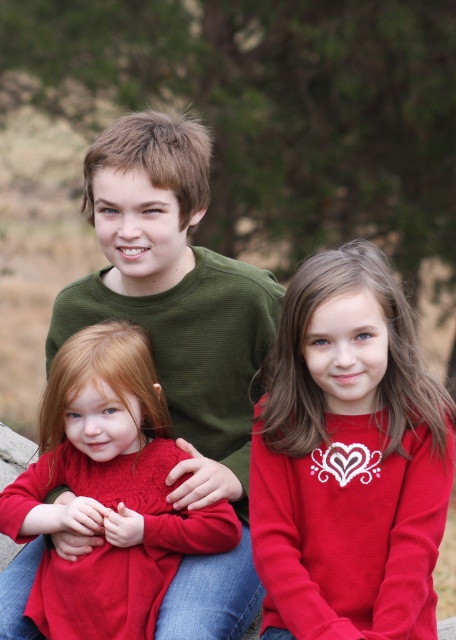
Question: Which point is closer to the camera?

Choices:
 (A) (171, 493)
 (B) (66, 516)
 (C) (290, 531)

Answer: (C)

Question: Is green textured sweater at center bigger than matte red sweater at left?

Choices:
 (A) yes
 (B) no

Answer: (A)

Question: Is matte red sweater at center smaller than green textured sweater at center?

Choices:
 (A) no
 (B) yes

Answer: (B)

Question: Is matte red sweater at center to the right of green textured sweater at center from the viewer's perspective?

Choices:
 (A) yes
 (B) no

Answer: (A)

Question: Estimate the real-world distances between objects in this image. Which object is farther from the matte red sweater at center?

Choices:
 (A) matte red sweater at left
 (B) green textured sweater at center

Answer: (A)

Question: Which of the following is the closest to the observer?

Choices:
 (A) (399, 496)
 (B) (171, 152)

Answer: (A)